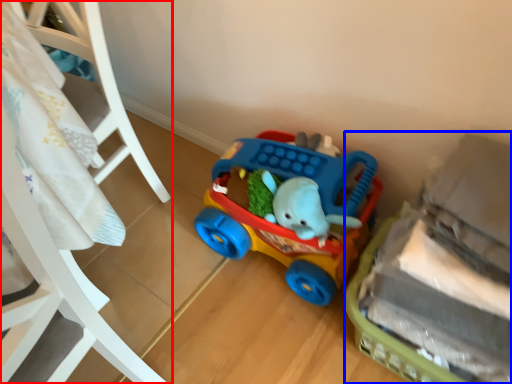
Question: Which point is closer to the camera, furniture (highlighted by a red box) or toy (highlighted by a blue box)?

Choices:
 (A) furniture
 (B) toy

Answer: (A)